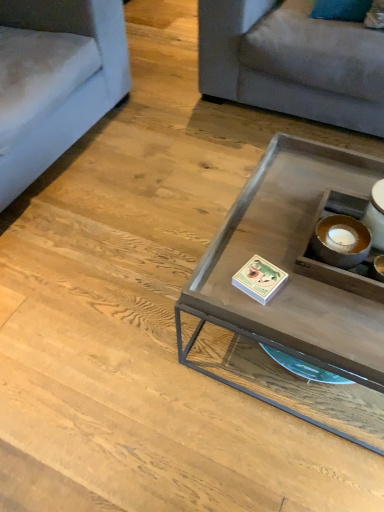
You are a GUI agent. You are given a task and a screenshot of the screen. Output one action in this format:
    pyautogui.click(x=<x>, y=<y>)
    Task: Click on the free space that is in between light blue fabric couch at left, which is the second studio couch in right-to-left order, and matte glass coffee table at center
    This screenshot has width=384, height=512.
    Given the screenshot: What is the action you would take?
    pyautogui.click(x=139, y=206)